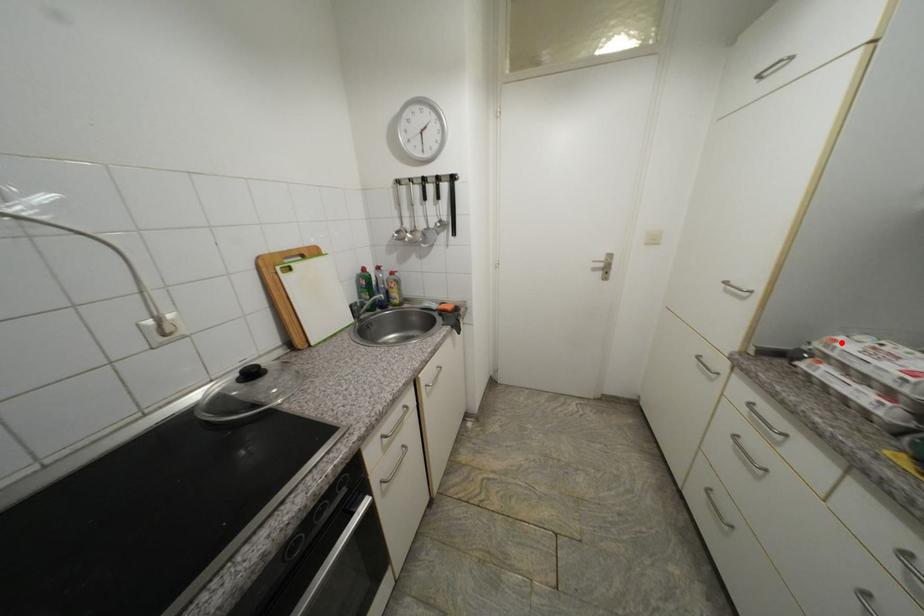
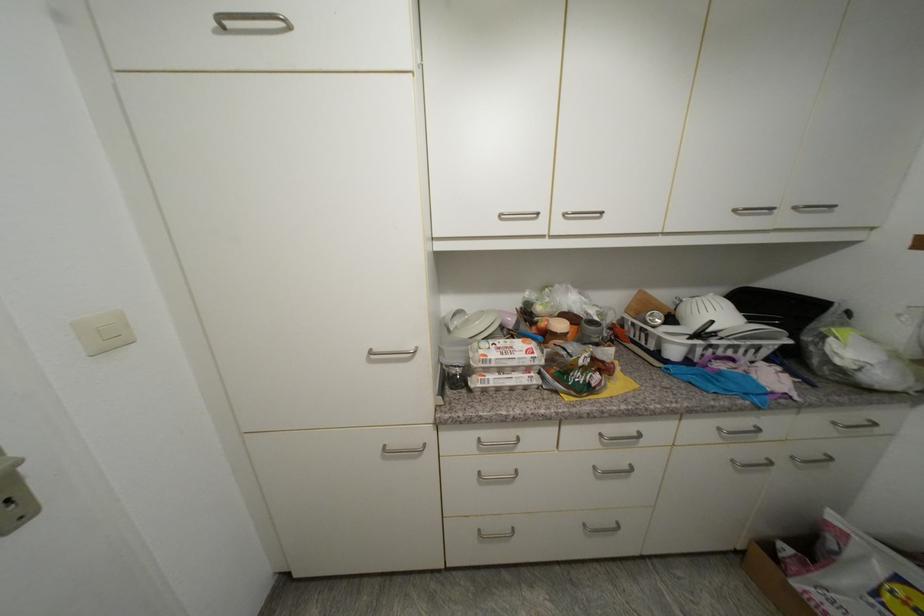
Question: I am providing you with two images of the same scene from different viewpoints. A red point is marked on the first image. At the location where the point appears in image 1, is it still visible in image 2?

Choices:
 (A) Yes
 (B) No

Answer: (A)